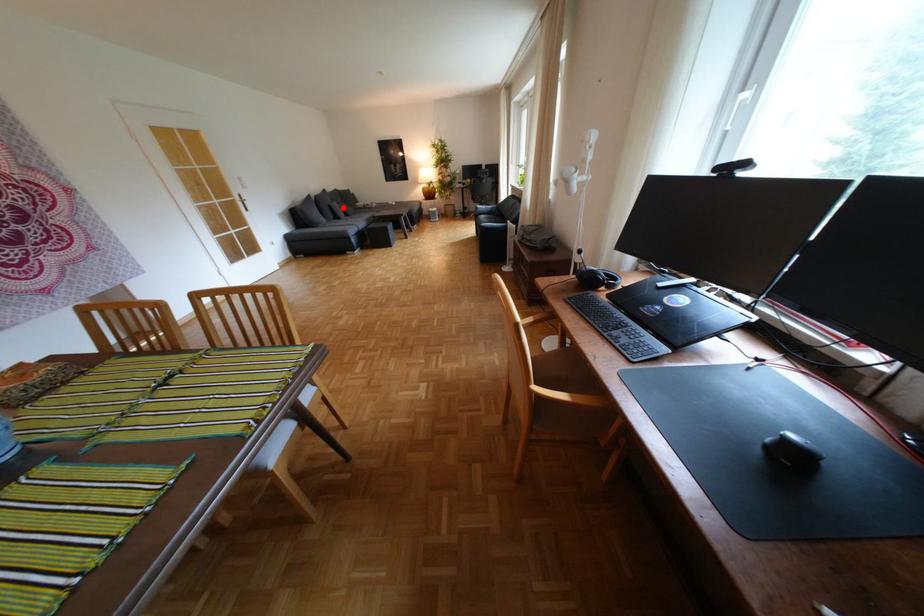
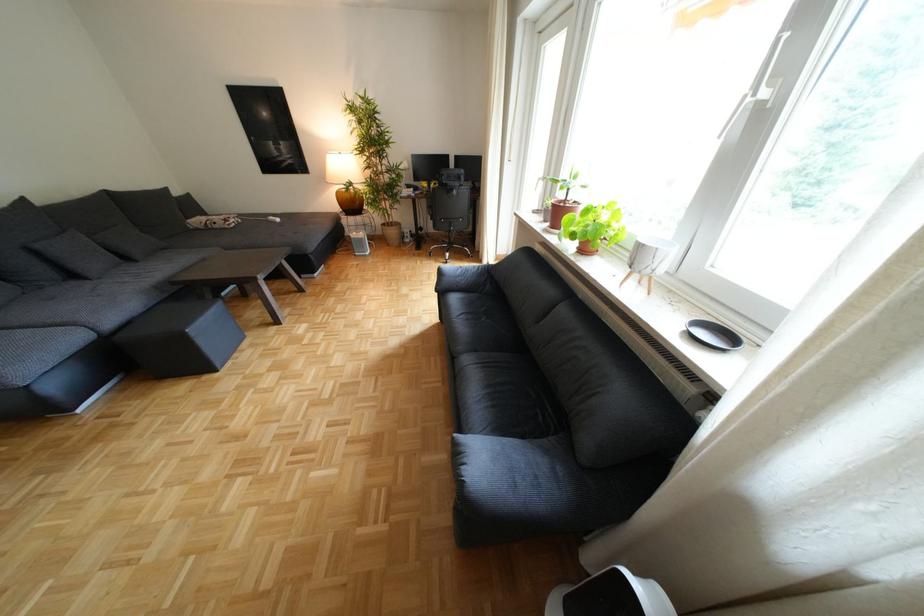
Question: A red point is marked in image1. In image2, is the corresponding 3D point closer to the camera or farther? Reply with the corresponding letter.

Choices:
 (A) The corresponding 3D point is closer.
 (B) The corresponding 3D point is farther.

Answer: (B)